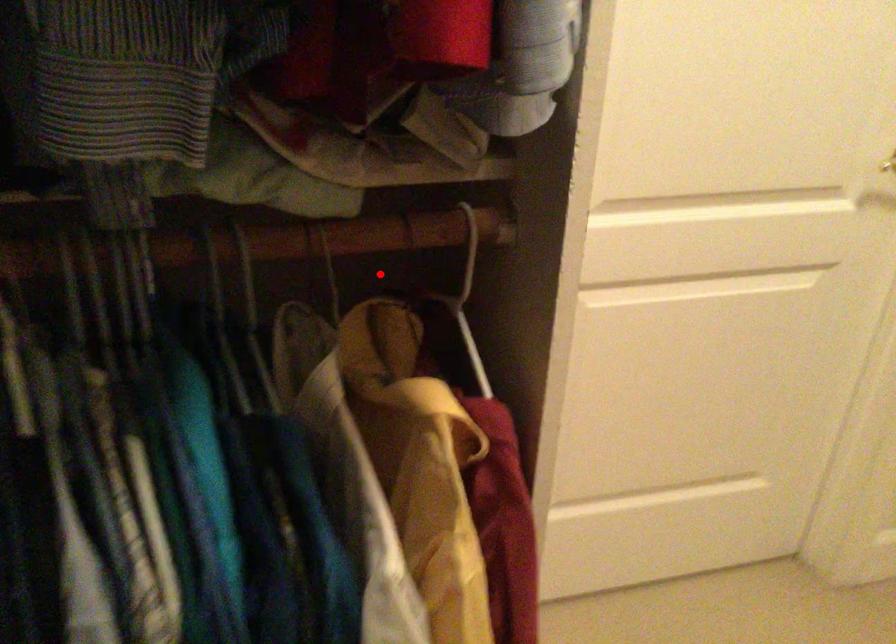
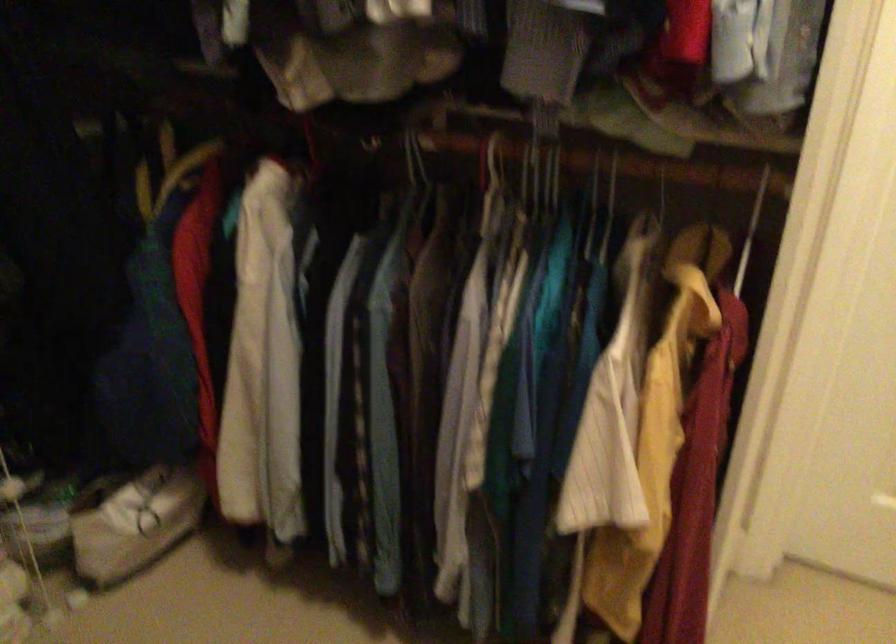
Locate, in the second image, the point that corresponds to the highlighted location in the first image.

(751, 230)